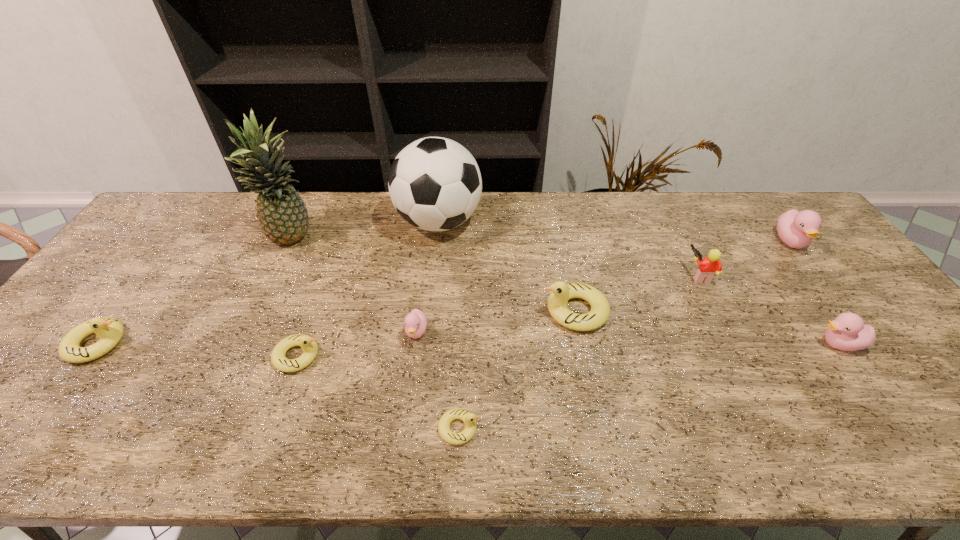
Find the location of a particular element. This screenshot has height=540, width=960. the second smallest pink duckling is located at coordinates (847, 332).

Locate an element on the screen. the leftmost duckling is located at coordinates tap(110, 331).

Image resolution: width=960 pixels, height=540 pixels. Find the location of `the leftmost yellow duckling`. the leftmost yellow duckling is located at coordinates (110, 331).

The height and width of the screenshot is (540, 960). Find the location of `the leftmost pink duckling`. the leftmost pink duckling is located at coordinates (415, 323).

Image resolution: width=960 pixels, height=540 pixels. Identify the location of the third duckling from left to right. (415, 323).

Identify the location of the second yellow duckling from left to right. (309, 346).

Where is `the second smallest yellow duckling`? the second smallest yellow duckling is located at coordinates (309, 346).

Locate an element on the screen. the shortest object is located at coordinates (468, 418).

The width and height of the screenshot is (960, 540). What are the coordinates of `the nearest yellow duckling` in the screenshot? It's located at (468, 418).

This screenshot has height=540, width=960. What are the coordinates of `free space located on the right of the tallest object` in the screenshot? It's located at (414, 240).